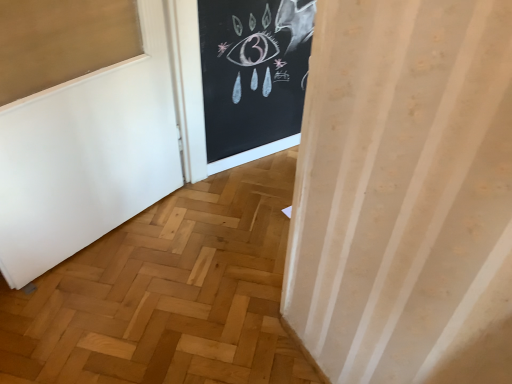
Measure the distance between white matte door at lower left and camera.

white matte door at lower left is 4.13 feet away from camera.

Measure the distance between point (71, 222) and camera.

Point (71, 222) and camera are 5.33 feet apart from each other.

What do you see at coordinates (87, 156) in the screenshot? The width and height of the screenshot is (512, 384). I see `white matte door at lower left` at bounding box center [87, 156].

The image size is (512, 384). I want to click on white matte door at lower left, so click(87, 156).

The height and width of the screenshot is (384, 512). I want to click on white matte door at lower left, so click(x=87, y=156).